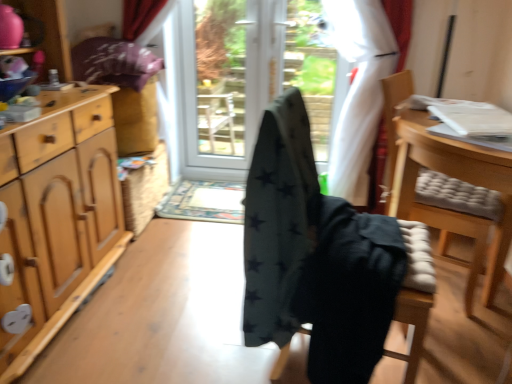
Question: Choose the correct answer: Is wooden cushioned chair at right, placed as the third chair when sorted from left to right, inside dark gray fabric chair at center, which is the first chair from left to right, or outside it?

Choices:
 (A) inside
 (B) outside

Answer: (B)

Question: In terms of size, does wooden cushioned chair at right, the 1th chair positioned from the right, appear bigger or smaller than dark gray fabric chair at center, which is the first chair from left to right?

Choices:
 (A) big
 (B) small

Answer: (A)

Question: Estimate the real-world distances between objects in this image. Which object is farther from the light wood cabinet at left?

Choices:
 (A) dark green fabric chair at center, positioned as the 2th chair in right-to-left order
 (B) dark gray fabric chair at center, which is counted as the third chair, starting from the right
 (C) white glossy screen door at center, which is the 1th screen door from left to right
 (D) black fabric screen door at center, which is the first screen door from right to left
 (E) wooden cushioned chair at right, placed as the third chair when sorted from left to right

Answer: (C)

Question: Which object is positioned closest to the black fabric screen door at center, which is the first screen door from right to left?

Choices:
 (A) dark green fabric chair at center, positioned as the 2th chair in right-to-left order
 (B) dark gray fabric chair at center, which is counted as the third chair, starting from the right
 (C) wooden cushioned chair at right, the 1th chair positioned from the right
 (D) white glossy screen door at center, which is the second screen door from right to left
 (E) light wood cabinet at left

Answer: (D)